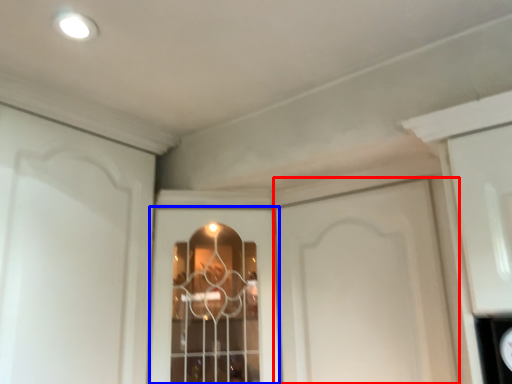
Question: Which of the following is the closest to the observer, door (highlighted by a red box) or window (highlighted by a blue box)?

Choices:
 (A) door
 (B) window

Answer: (A)